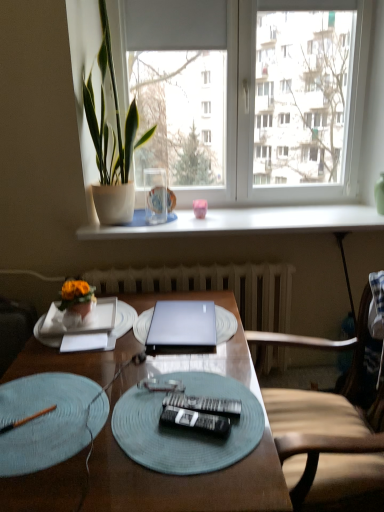
Locate an element on the screen. free space in front of white paper at center is located at coordinates (76, 373).